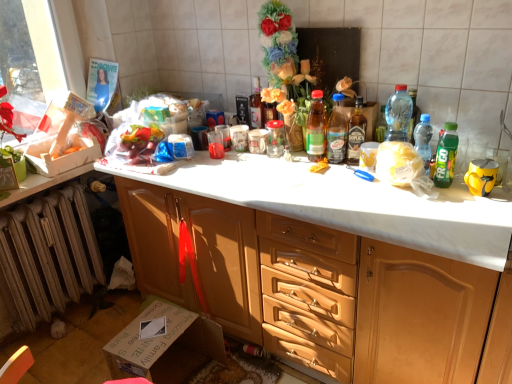
Question: In terms of width, does green plastic bottle at right, which ranks as the 1th bottle in right-to-left order, look wider or thinner when compared to transparent plastic bottle at right, which is counted as the fifth bottle, starting from the left?

Choices:
 (A) wide
 (B) thin

Answer: (B)

Question: In the image, is green plastic bottle at right, which ranks as the 7th bottle in left-to-right order, on the left side or the right side of transparent plastic bottle at right, which is counted as the fifth bottle, starting from the left?

Choices:
 (A) right
 (B) left

Answer: (A)

Question: Considering the real-world distances, which object is farthest from the transparent plastic bottle at right, which is counted as the fifth bottle, starting from the left?

Choices:
 (A) wooden cabinet at center
 (B) translucent plastic bottle at upper right, which is counted as the second bottle, starting from the right
 (C) transparent glass jar at center
 (D) translucent plastic bottle at center, which is the 5th bottle from right to left
 (E) translucent plastic bottle at center, the 6th bottle when ordered from right to left

Answer: (A)

Question: Which object is the farthest from the translucent plastic bottle at center, the 6th bottle when ordered from right to left?

Choices:
 (A) translucent plastic bottle at upper right, marked as the sixth bottle in a left-to-right arrangement
 (B) transparent plastic bottle at right, the 3th bottle in the right-to-left sequence
 (C) rusty metal radiator at lower left
 (D) translucent glass bottle at center, the 1th bottle when ordered from left to right
 (E) green plastic bottle at right, which ranks as the 7th bottle in left-to-right order

Answer: (C)